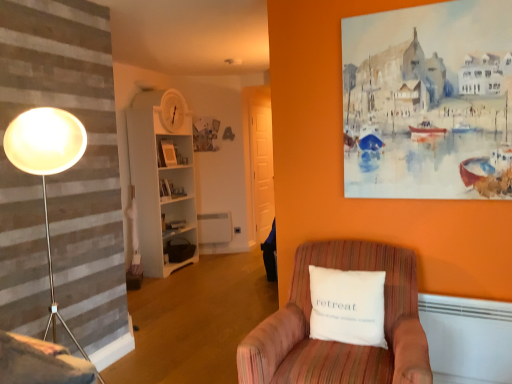
This screenshot has width=512, height=384. Find the location of `vacant region to the right of white wood bookshelf at center`. vacant region to the right of white wood bookshelf at center is located at coordinates (208, 266).